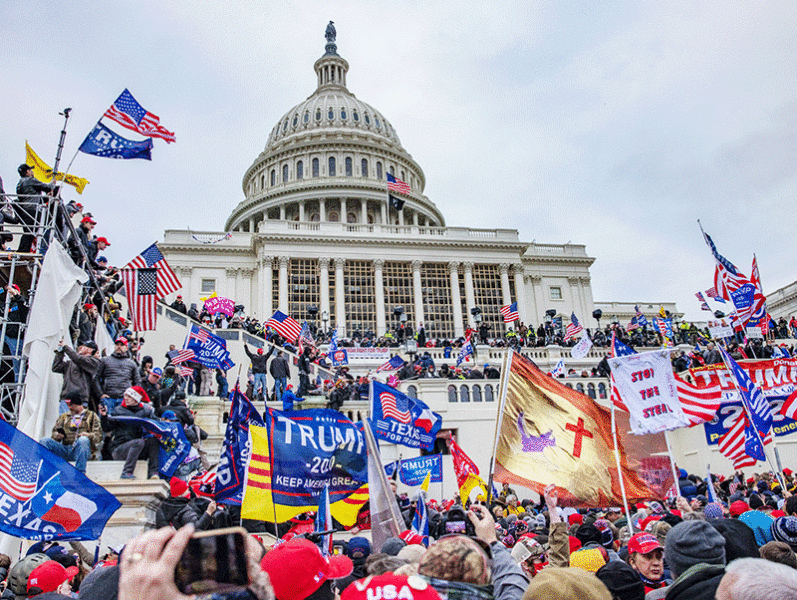
Where is `phone`? phone is located at coordinates (199, 564).